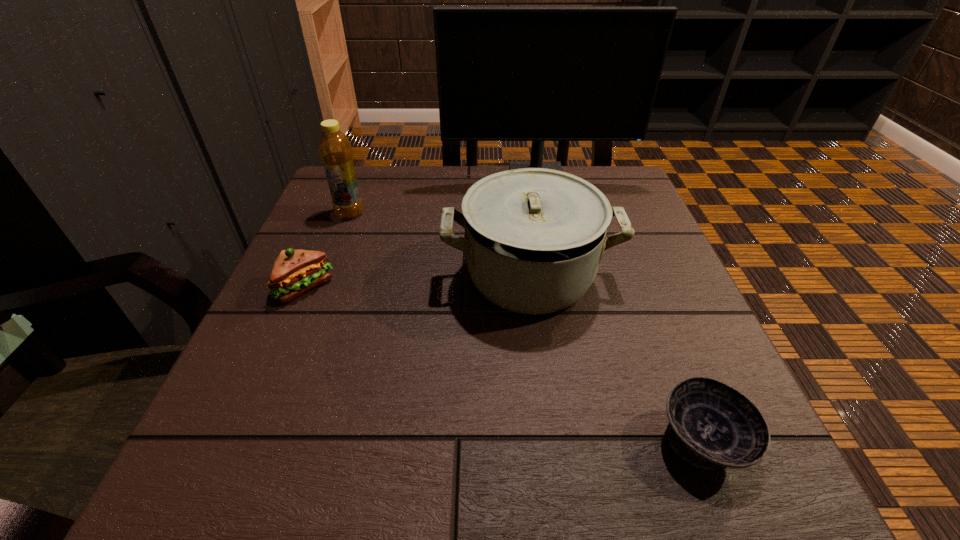
At what (x,y) coordinates should I click in order to perform the action: click on the farthest object. Please return your answer as a coordinate pair (x, y). The image size is (960, 540). Looking at the image, I should click on (538, 74).

The height and width of the screenshot is (540, 960). I want to click on the tallest object, so click(538, 74).

The height and width of the screenshot is (540, 960). I want to click on the second tallest object, so click(335, 150).

The height and width of the screenshot is (540, 960). I want to click on bottle, so click(x=335, y=150).

This screenshot has width=960, height=540. What are the coordinates of `the third shortest object` in the screenshot? It's located at (534, 237).

You are a GUI agent. You are given a task and a screenshot of the screen. Output one action in this format:
    pyautogui.click(x=<x>, y=<y>)
    Task: Click on the second shortest object
    
    Given the screenshot: What is the action you would take?
    pyautogui.click(x=294, y=272)

The width and height of the screenshot is (960, 540). In order to click on the nearest object in this screenshot , I will do `click(711, 425)`.

The height and width of the screenshot is (540, 960). I want to click on bowl, so click(711, 425).

The height and width of the screenshot is (540, 960). I want to click on vacant region located 0.290m on the front-facing side of the computer monitor, so click(x=553, y=264).

Locate an element on the screen. free space located on the right of the fourth shortest object is located at coordinates (524, 213).